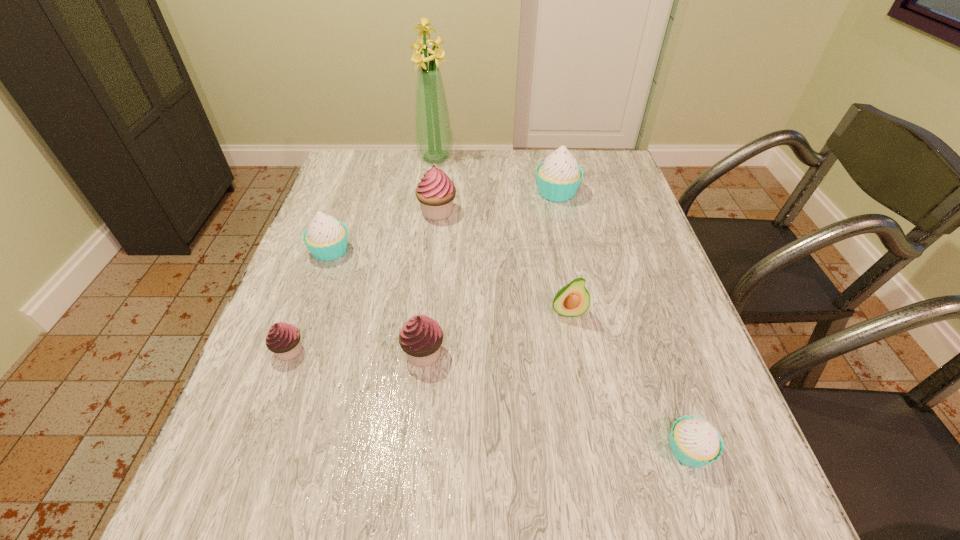
Find the location of a particular element. The width and height of the screenshot is (960, 540). free space located 0.110m on the back of the rightmost white cupcake is located at coordinates [x=663, y=374].

This screenshot has width=960, height=540. Find the location of `bouquet that is positioned at the far edge`. bouquet that is positioned at the far edge is located at coordinates (433, 132).

Where is `cupcake present at the far edge`? The height and width of the screenshot is (540, 960). cupcake present at the far edge is located at coordinates (558, 178).

Where is `object that is at the far right corner`? The height and width of the screenshot is (540, 960). object that is at the far right corner is located at coordinates (558, 178).

The height and width of the screenshot is (540, 960). What are the coordinates of `free spot at the far edge of the desktop` in the screenshot? It's located at (422, 163).

Locate an element on the screen. The width and height of the screenshot is (960, 540). free region at the near edge of the desktop is located at coordinates (464, 489).

Image resolution: width=960 pixels, height=540 pixels. In the image, there is a desktop. In order to click on blank space at the left edge in this screenshot , I will do `click(246, 440)`.

Locate an element on the screen. vacant space at the right edge of the desktop is located at coordinates (591, 220).

At what (x,y) coordinates should I click in order to perform the action: click on vacant space at the near left corner. Please return your answer as a coordinate pair (x, y). The width and height of the screenshot is (960, 540). Looking at the image, I should click on (291, 510).

This screenshot has height=540, width=960. In the image, there is a desktop. What are the coordinates of `vacant space at the far right corner` in the screenshot? It's located at (616, 184).